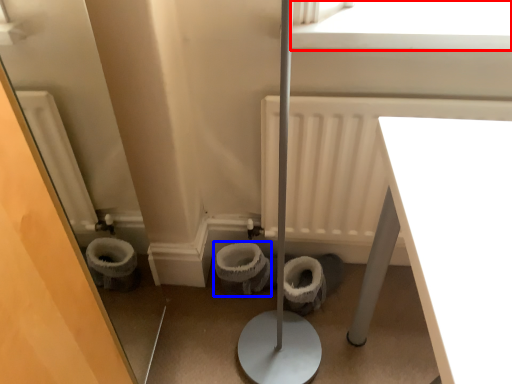
Question: Which object appears closest to the camera in this image, window screen (highlighted by a red box) or toilet bowl (highlighted by a blue box)?

Choices:
 (A) window screen
 (B) toilet bowl

Answer: (A)